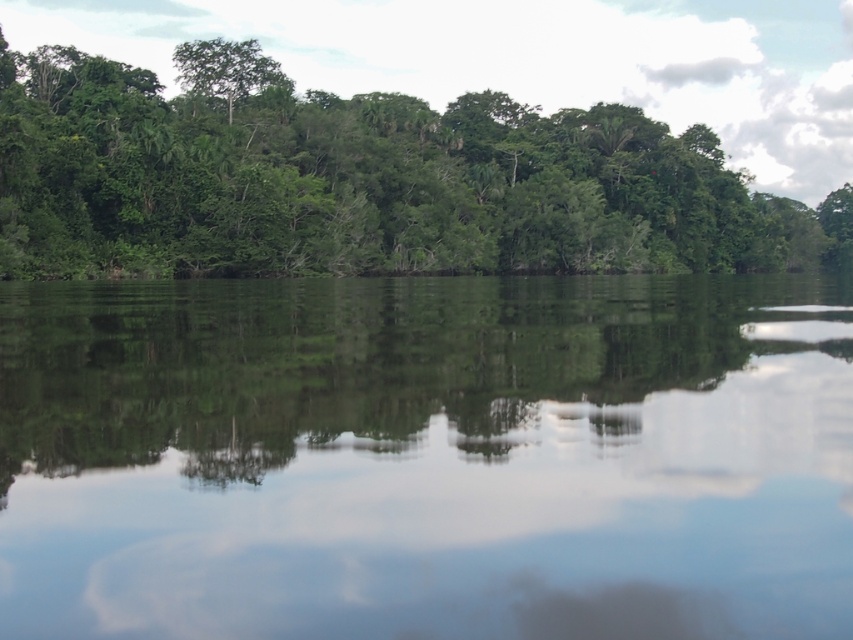
Question: Can you confirm if green leafy trees at upper center is bigger than green leafy tree at upper left?

Choices:
 (A) yes
 (B) no

Answer: (B)

Question: Which point is farther to the camera?

Choices:
 (A) (151, 396)
 (B) (228, 86)

Answer: (B)

Question: Can you confirm if transparent water at center is bigger than green leafy trees at upper center?

Choices:
 (A) yes
 (B) no

Answer: (B)

Question: Can you confirm if transparent water at center is positioned below green leafy trees at upper center?

Choices:
 (A) yes
 (B) no

Answer: (A)

Question: Which point is farther to the camera?

Choices:
 (A) (202, 80)
 (B) (582, 225)
 (C) (751, 618)

Answer: (A)

Question: Which point is closer to the camera?

Choices:
 (A) (192, 60)
 (B) (486, 468)

Answer: (B)